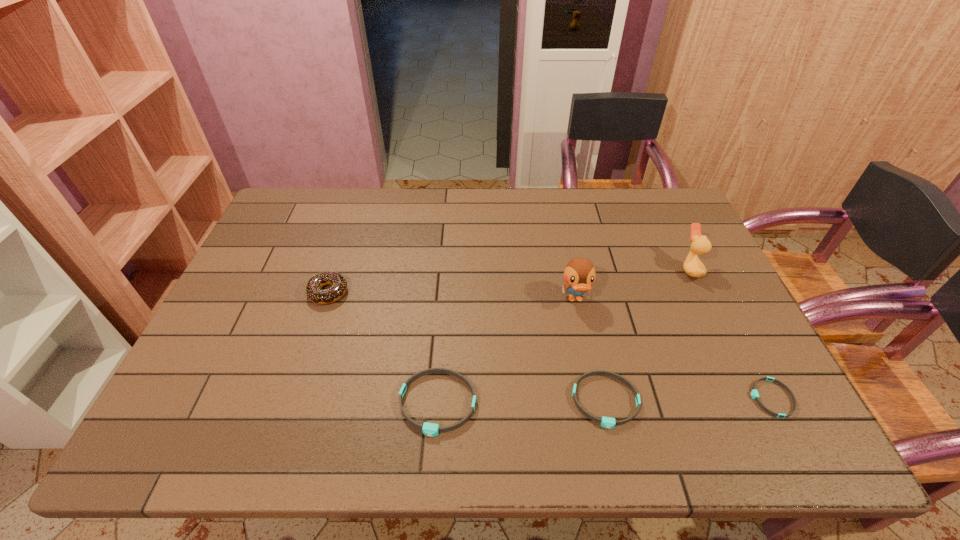
Image resolution: width=960 pixels, height=540 pixels. What are the coordinates of `vacant space that is in between the shortest object and the farther duck` in the screenshot? It's located at (731, 334).

The height and width of the screenshot is (540, 960). I want to click on free spot between the third tallest object and the second wristband from left to right, so click(x=467, y=347).

Image resolution: width=960 pixels, height=540 pixels. In order to click on vacant space in between the second object from left to right and the farther duck in this screenshot , I will do `click(564, 336)`.

The height and width of the screenshot is (540, 960). Find the location of `unoccupied position between the rightmost wristband and the farther duck`. unoccupied position between the rightmost wristband and the farther duck is located at coordinates (731, 334).

The image size is (960, 540). In order to click on vacant area that lies between the farther duck and the second shortest wristband in this screenshot , I will do `click(648, 335)`.

Where is `free space that is in between the shortest object and the leftmost wristband`? This screenshot has width=960, height=540. free space that is in between the shortest object and the leftmost wristband is located at coordinates (605, 401).

The image size is (960, 540). I want to click on the closest object to the leftmost object, so click(x=429, y=429).

You are a GUI agent. You are given a task and a screenshot of the screen. Output one action in this format:
    pyautogui.click(x=<x>, y=<y>)
    Task: Click on the object that stands as the second closest to the second wristband from left to right
    
    Given the screenshot: What is the action you would take?
    pyautogui.click(x=429, y=429)

Select which wristband appears as the closest to the left duck. Please provide its 2D coordinates. Your answer should be formatted as a tuple, i.e. [(x, y)], where the tuple contains the x and y coordinates of a point satisfying the conditions above.

[(607, 422)]

I want to click on wristband that stands as the second closest to the third tallest object, so click(607, 422).